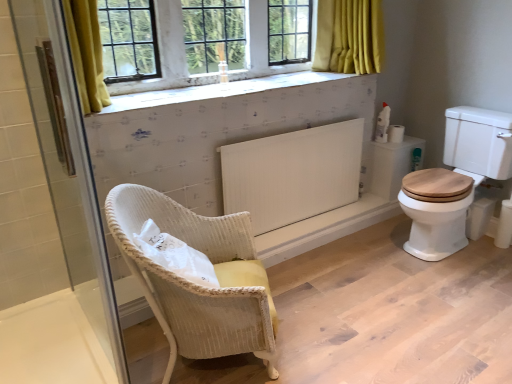
Find the location of a particular element. free location to the right of white plastic spray bottle at upper right is located at coordinates (404, 139).